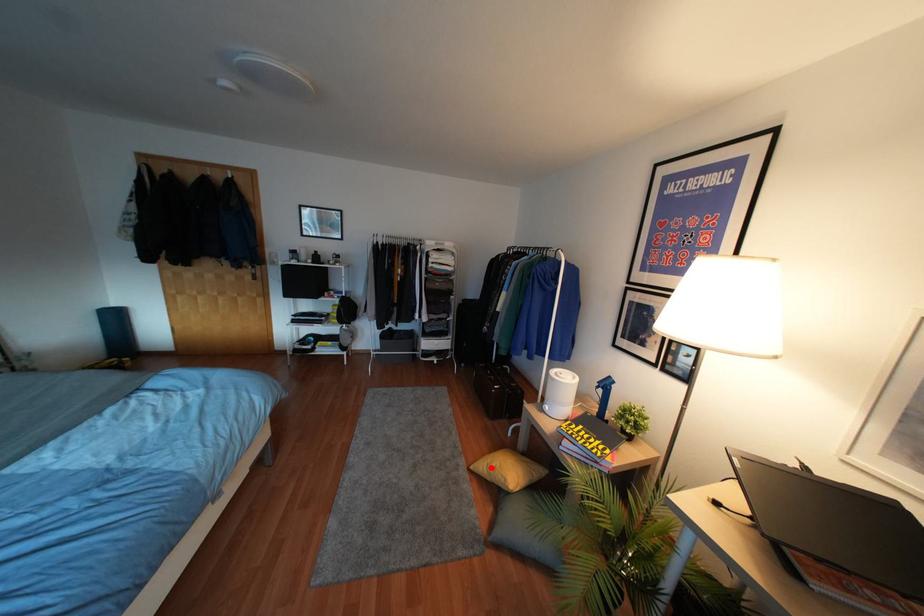
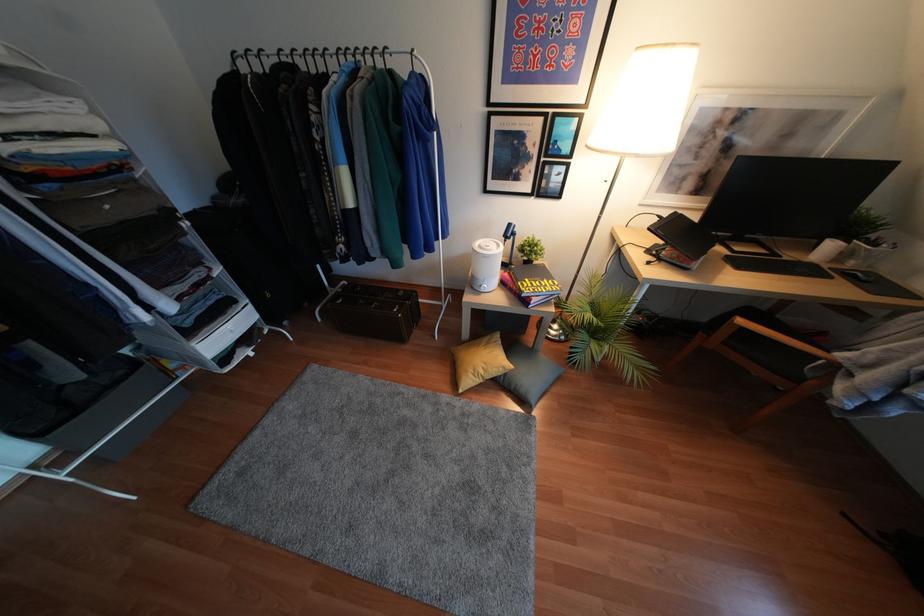
Locate, in the second image, the point that corresponds to the highlighted location in the first image.

(480, 371)